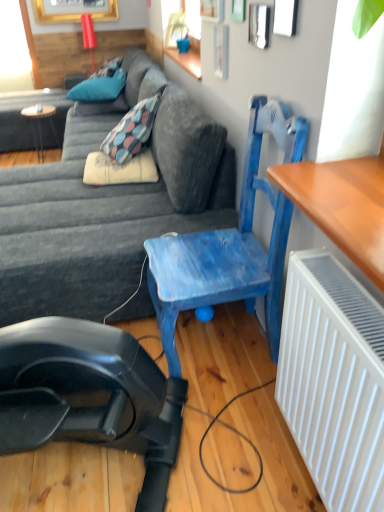
Question: From the image's perspective, is wooden round table at left located above or below blue painted wood chair at center?

Choices:
 (A) above
 (B) below

Answer: (A)

Question: In terms of width, does wooden round table at left look wider or thinner when compared to blue painted wood chair at center?

Choices:
 (A) thin
 (B) wide

Answer: (A)

Question: Which object is positioned closest to the beige fabric pillow at center, the 3th pillow in the back-to-front sequence?

Choices:
 (A) blue painted wood chair at center
 (B) teal fabric pillow at upper left, arranged as the first pillow when viewed from the back
 (C) wooden round table at left
 (D) blue fabric pillow at upper left, which is the third pillow from bottom to top
 (E) dark gray fabric couch at center

Answer: (E)

Question: Which of these objects is positioned closest to the blue painted wood chair at center?

Choices:
 (A) teal fabric pillow at upper left, arranged as the first pillow when viewed from the back
 (B) dark gray fabric couch at center
 (C) beige fabric pillow at center, which ranks as the third pillow in top-to-bottom order
 (D) blue fabric pillow at upper left, which ranks as the second pillow in front-to-back order
 (E) wooden round table at left

Answer: (B)